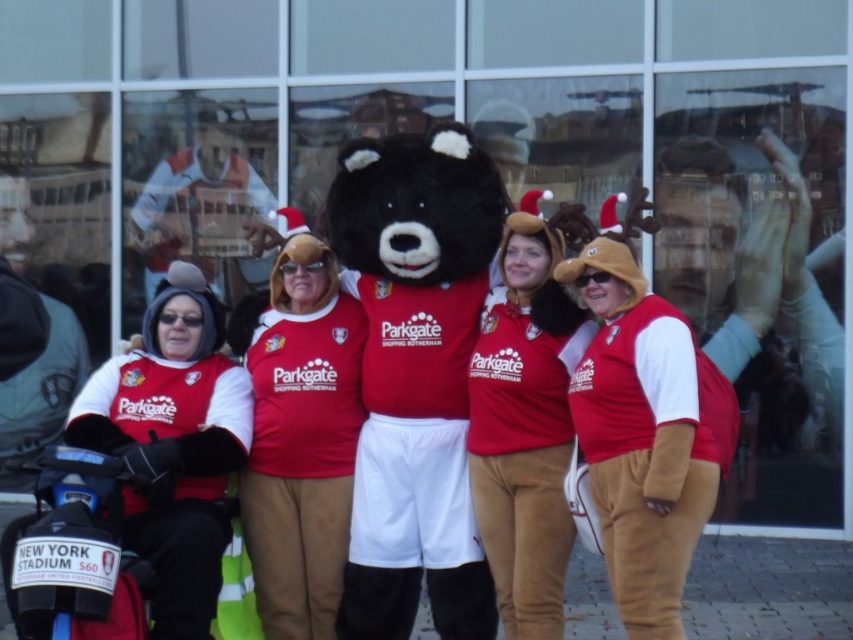
You are a photographer trying to capture the black plush bear at center and the velvet brown teddy bear at center in your shot. Which bear should you focus on first if you want to ensure both are in focus, given their positions?

The velvet brown teddy bear at center should be focused on first because it is lower and closer to the camera, ensuring both bears will be in focus when using depth of field techniques.

You are standing at the point closest to the camera. Which of the two points, point (448, 257) or point (515, 438), is farther away from you?

Point (448, 257) is behind point (515, 438), so the point farther away from you is point (448, 257).